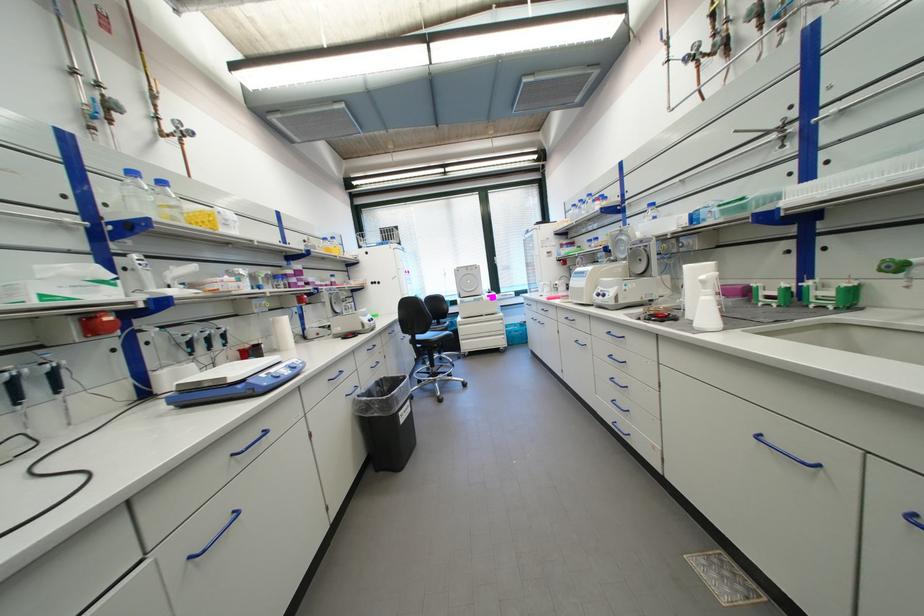
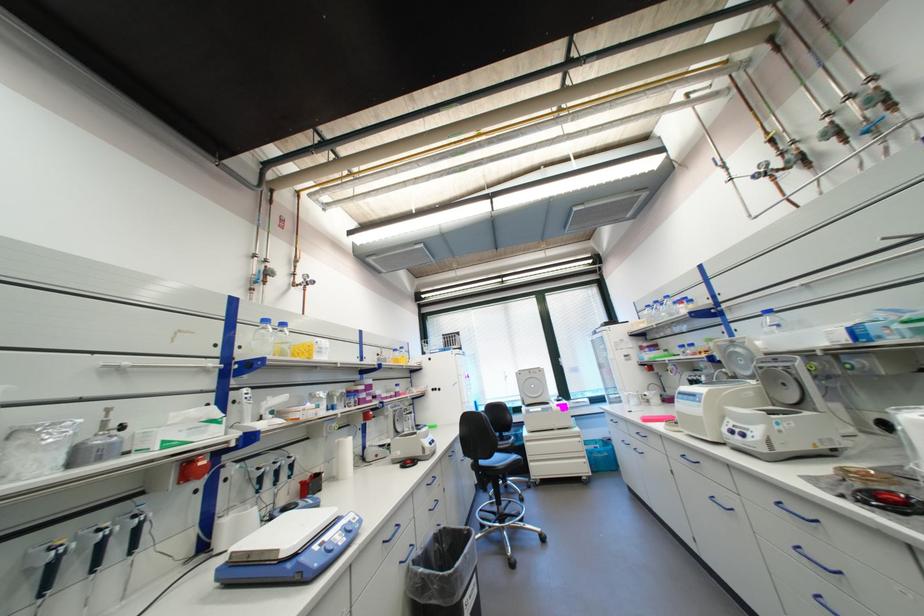
Where in the second image is the point corresponding to the point at 276,334 from the first image?

(339, 458)